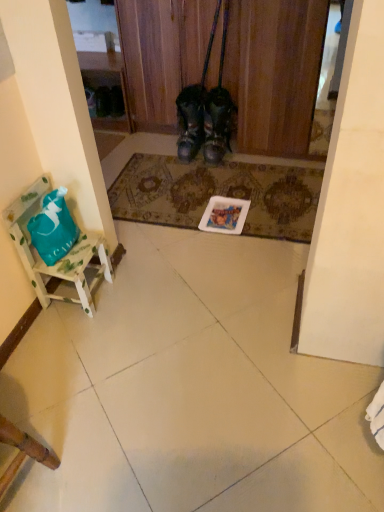
The width and height of the screenshot is (384, 512). I want to click on vacant space to the right of leather boots at center, which is the second footwear from left to right, so click(246, 156).